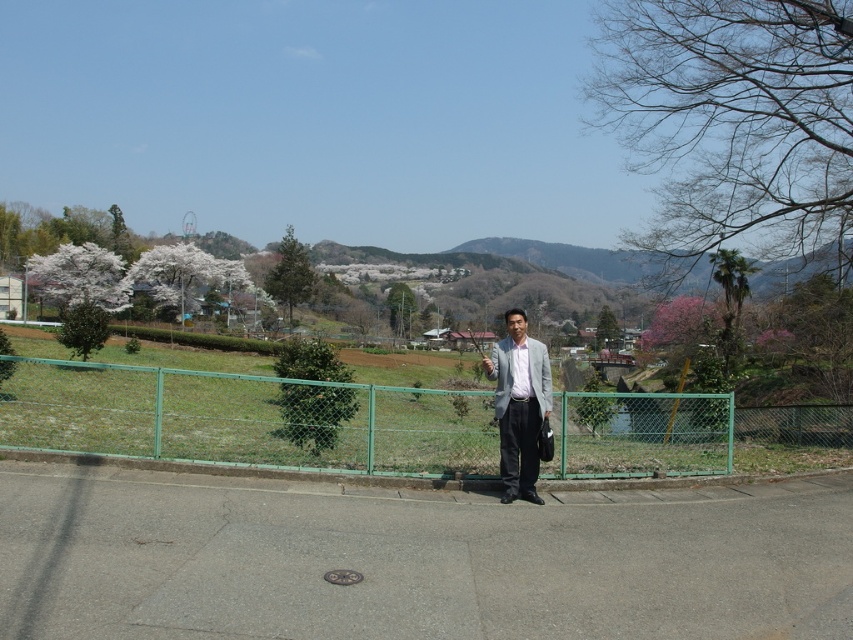
Question: Based on their relative distances, which object is nearer to the gray asphalt pavement at center?

Choices:
 (A) green chain-link fence at center
 (B) light gray suit at center

Answer: (B)

Question: Which point is closer to the camera?

Choices:
 (A) light gray suit at center
 (B) green chain-link fence at center
 (C) gray asphalt pavement at center

Answer: (C)

Question: Can you confirm if gray asphalt pavement at center is thinner than light gray suit at center?

Choices:
 (A) no
 (B) yes

Answer: (A)

Question: Does green chain-link fence at center have a larger size compared to light gray suit at center?

Choices:
 (A) no
 (B) yes

Answer: (B)

Question: Which object is the farthest from the green chain-link fence at center?

Choices:
 (A) gray asphalt pavement at center
 (B) light gray suit at center

Answer: (B)

Question: Can you confirm if gray asphalt pavement at center is thinner than light gray suit at center?

Choices:
 (A) no
 (B) yes

Answer: (A)